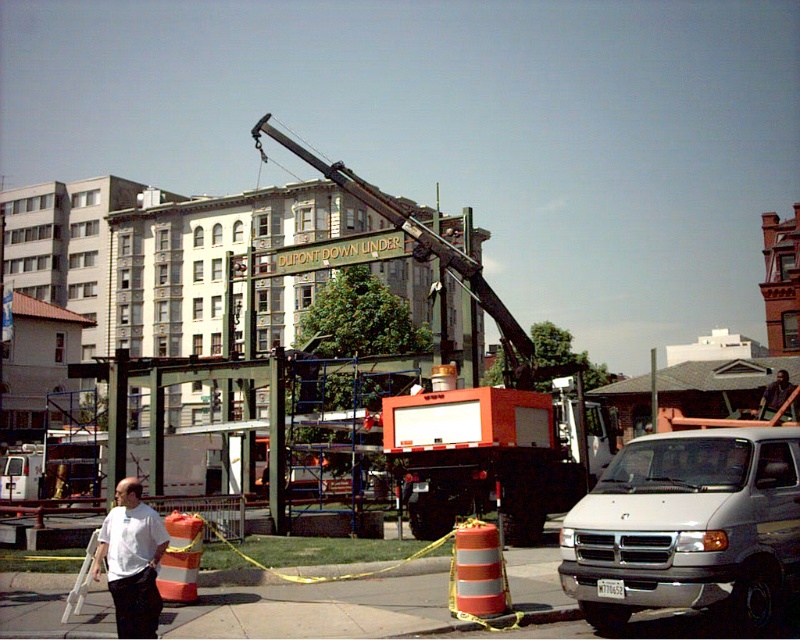
Question: Can you confirm if white matte van at center is bigger than orange matte truck at center?

Choices:
 (A) yes
 (B) no

Answer: (A)

Question: Does orange matte truck at center have a greater width compared to white shirt at center?

Choices:
 (A) no
 (B) yes

Answer: (A)

Question: Is white matte van at center positioned behind white shirt at center?

Choices:
 (A) no
 (B) yes

Answer: (B)

Question: Which point is closer to the camera?

Choices:
 (A) white matte van at center
 (B) white shirt at center
 (C) orange matte truck at center
 (D) dark brown leather jacket at center

Answer: (B)

Question: Estimate the real-world distances between objects in this image. Which object is farther from the orange matte truck at center?

Choices:
 (A) dark brown leather jacket at center
 (B) white matte van at center
 (C) white shirt at center

Answer: (A)

Question: Which of the following is the closest to the observer?

Choices:
 (A) (452, 401)
 (B) (780, 404)
 (C) (126, 480)
 (D) (772, 586)

Answer: (D)